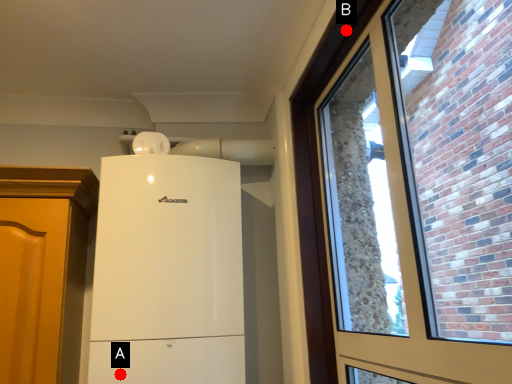
Question: Two points are circled on the image, labeled by A and B beside each circle. Among these points, which one is nearest to the camera?

Choices:
 (A) A is closer
 (B) B is closer

Answer: (B)